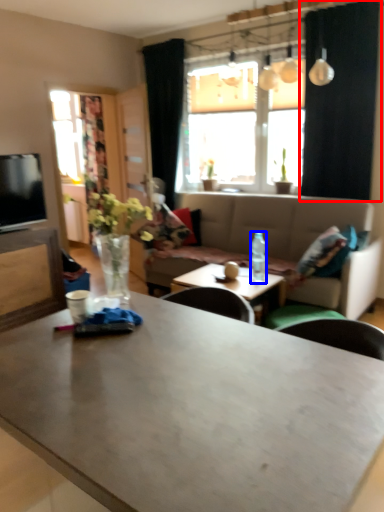
Question: Which object is further to the camera taking this photo, curtain (highlighted by a red box) or bottle (highlighted by a blue box)?

Choices:
 (A) curtain
 (B) bottle

Answer: (A)